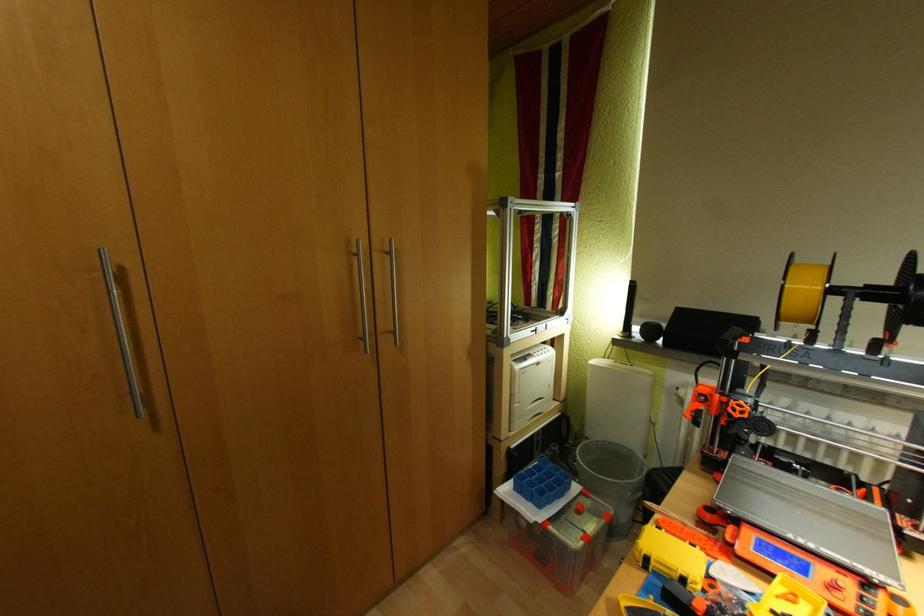
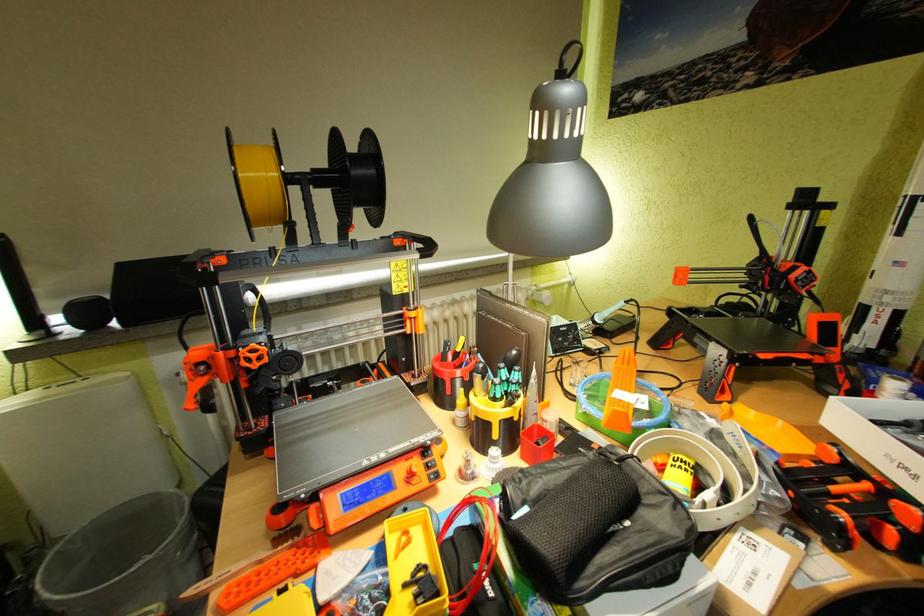
The images are taken continuously from a first-person perspective. In which direction is your viewpoint rotating?

The camera rotated toward right-down.